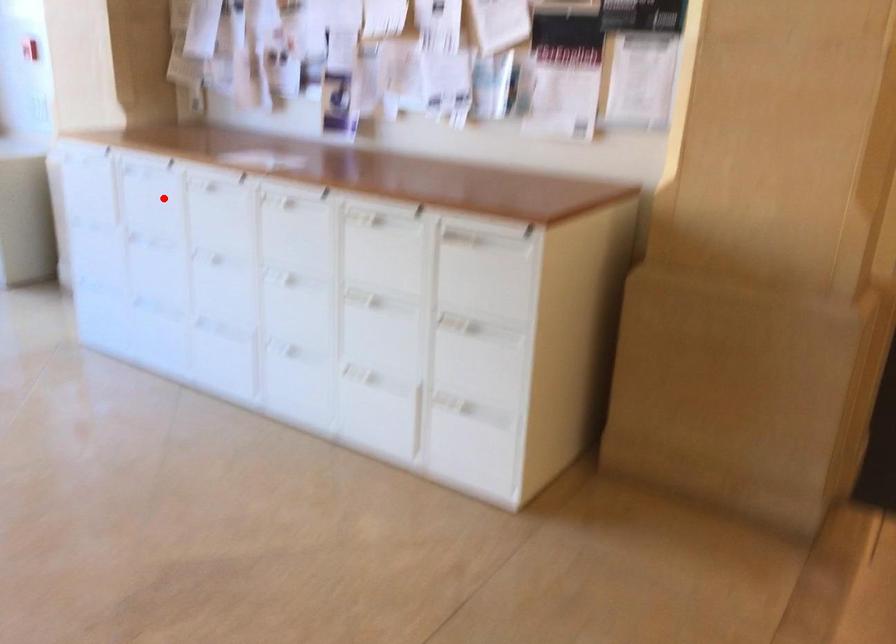
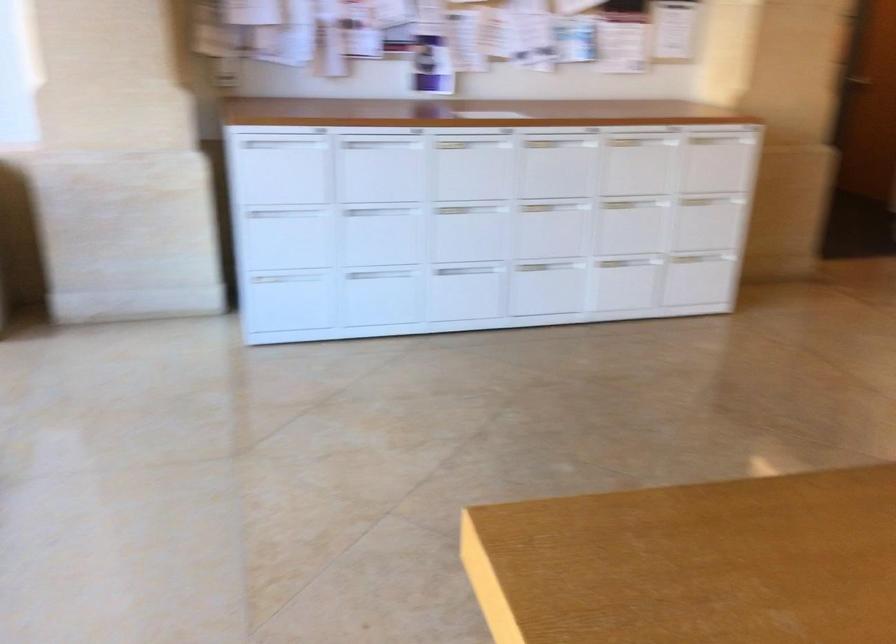
In the second image, find the point that corresponds to the highlighted location in the first image.

(380, 167)